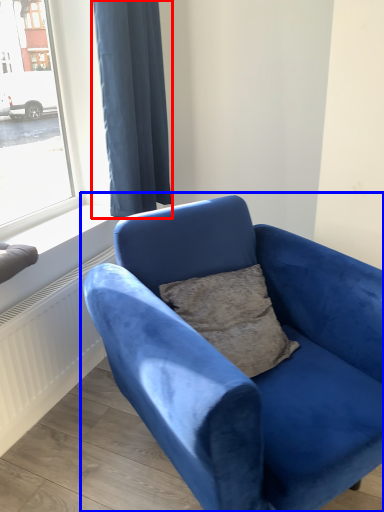
Question: Which point is further to the camera, curtain (highlighted by a red box) or studio couch (highlighted by a blue box)?

Choices:
 (A) curtain
 (B) studio couch

Answer: (A)